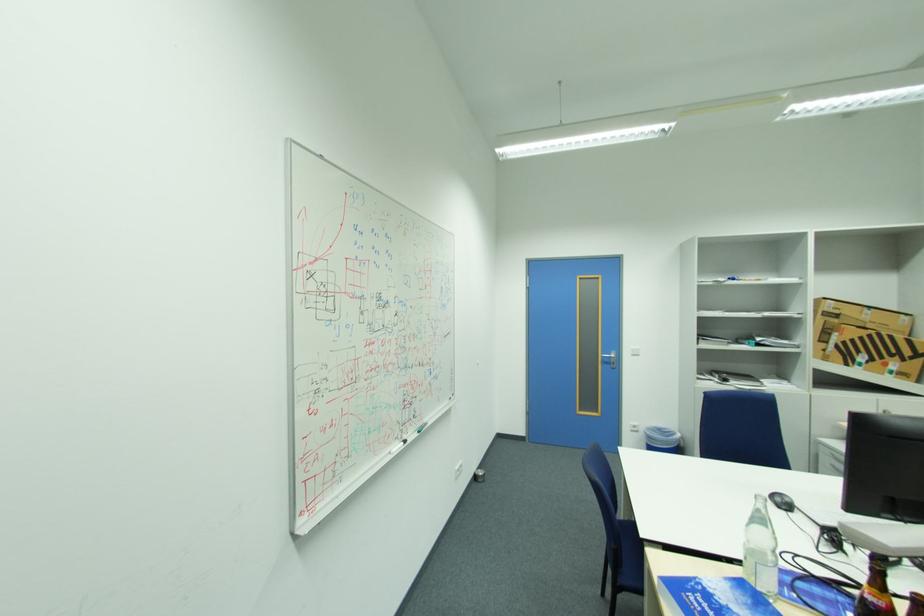
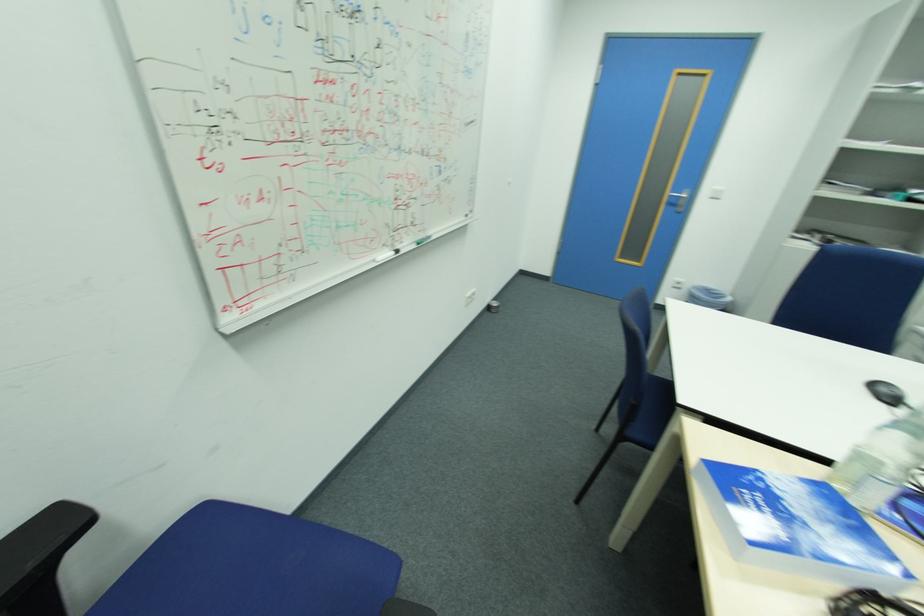
Question: The images are taken continuously from a first-person perspective. In which direction are you moving?

Choices:
 (A) Left
 (B) Right
 (C) Forward
 (D) Backward

Answer: (C)